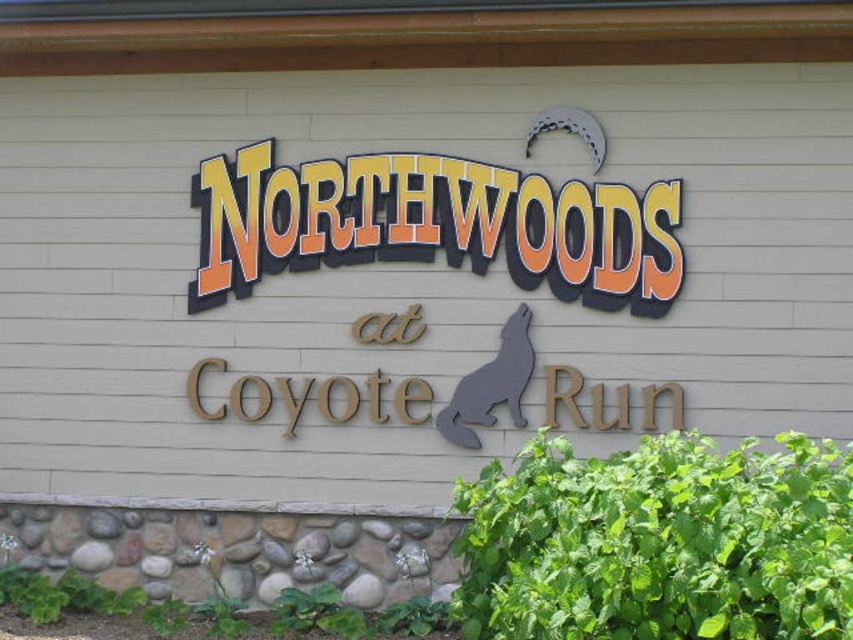
You are designing a layout for a new sign and need to ensure that the orange brick sign at center and the wooden coyote at center fit within a 1.2 meter wide space. Based on their sizes, will both items fit side by side horizontally?

The orange brick sign at center is wider than the wooden coyote at center. Since the combined width of both items would exceed the 1.2 meter space, they cannot fit side by side horizontally.

You are standing in front of the building and see the orange brick sign at center and the wooden coyote at center. Which object is located to the left?

The wooden coyote at center is located to the left of the orange brick sign at center.

You are standing in front of a building and see the orange brick sign at center and the wooden coyote at center. Which object is located higher up?

The orange brick sign at center is positioned over the wooden coyote at center, so it is higher up.